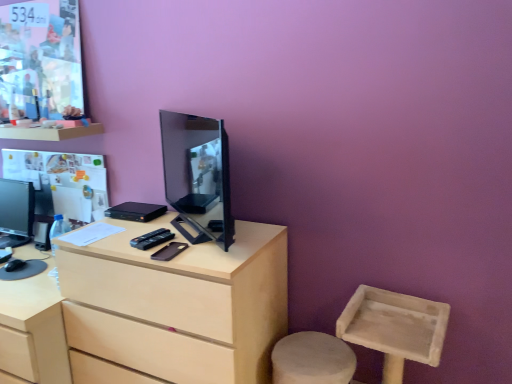
The width and height of the screenshot is (512, 384). Find the location of `free location to the left of matte black tv at center, which is the first television in right-to-left order`. free location to the left of matte black tv at center, which is the first television in right-to-left order is located at coordinates (140, 226).